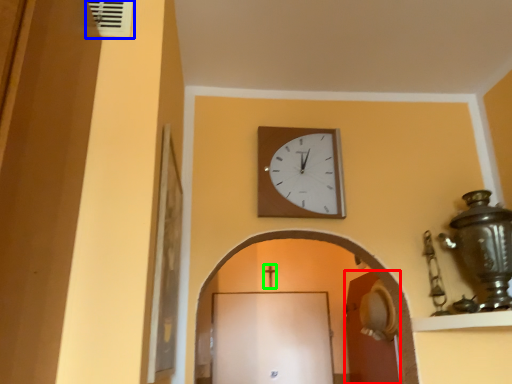
Question: Estimate the real-world distances between objects in this image. Which object is closer to door (highlighted by a red box), air conditioning (highlighted by a blue box) or crucifix (highlighted by a green box)?

Choices:
 (A) air conditioning
 (B) crucifix

Answer: (B)